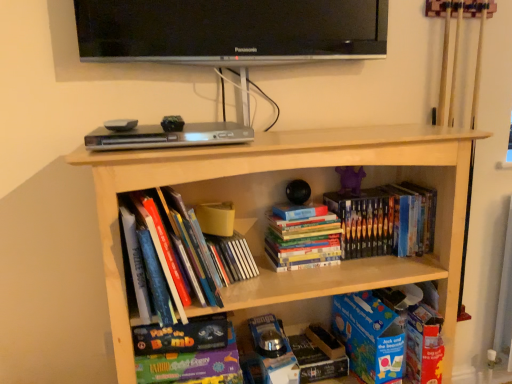
Question: Is matte board game at lower center, the 2th book from the left, turned away from blue cardboard book at lower right?

Choices:
 (A) yes
 (B) no

Answer: (B)

Question: Is matte board game at lower center, the 2th book from the left, taller than blue cardboard book at lower right?

Choices:
 (A) yes
 (B) no

Answer: (B)

Question: Does matte board game at lower center, which is the 3th book in right-to-left order, have a lesser height compared to blue cardboard book at lower right?

Choices:
 (A) no
 (B) yes

Answer: (B)

Question: Is matte board game at lower center, the 2th book from the left, smaller than blue cardboard book at lower right?

Choices:
 (A) no
 (B) yes

Answer: (B)

Question: Is matte board game at lower center, which is the 3th book in right-to-left order, further to the viewer compared to blue cardboard book at lower right?

Choices:
 (A) no
 (B) yes

Answer: (A)

Question: Is purple matte toy at center inside or outside of light wood bookcase at center?

Choices:
 (A) inside
 (B) outside

Answer: (A)

Question: Would you say purple matte toy at center is to the left or to the right of light wood bookcase at center in the picture?

Choices:
 (A) left
 (B) right

Answer: (B)

Question: Looking at their shapes, would you say purple matte toy at center is wider or thinner than light wood bookcase at center?

Choices:
 (A) thin
 (B) wide

Answer: (A)

Question: Is purple matte toy at center in front of or behind light wood bookcase at center in the image?

Choices:
 (A) behind
 (B) front

Answer: (A)

Question: Is matte board game at lower center, the 2th book from the left, situated inside hardcover books at center, the third book in the left-to-right sequence, or outside?

Choices:
 (A) outside
 (B) inside

Answer: (A)

Question: From the image's perspective, relative to hardcover books at center, arranged as the second book when viewed from the right, is matte board game at lower center, which is the 3th book in right-to-left order, above or below?

Choices:
 (A) above
 (B) below

Answer: (B)

Question: From a real-world perspective, is matte board game at lower center, which is the 3th book in right-to-left order, above or below hardcover books at center, arranged as the second book when viewed from the right?

Choices:
 (A) above
 (B) below

Answer: (B)

Question: In the image, is matte board game at lower center, which is the 3th book in right-to-left order, positioned in front of or behind hardcover books at center, arranged as the second book when viewed from the right?

Choices:
 (A) front
 (B) behind

Answer: (A)

Question: Considering their positions, is hardcover books at center, the third book in the left-to-right sequence, located in front of or behind purple matte toy at center?

Choices:
 (A) behind
 (B) front

Answer: (B)

Question: In terms of size, does hardcover books at center, the third book in the left-to-right sequence, appear bigger or smaller than purple matte toy at center?

Choices:
 (A) small
 (B) big

Answer: (B)